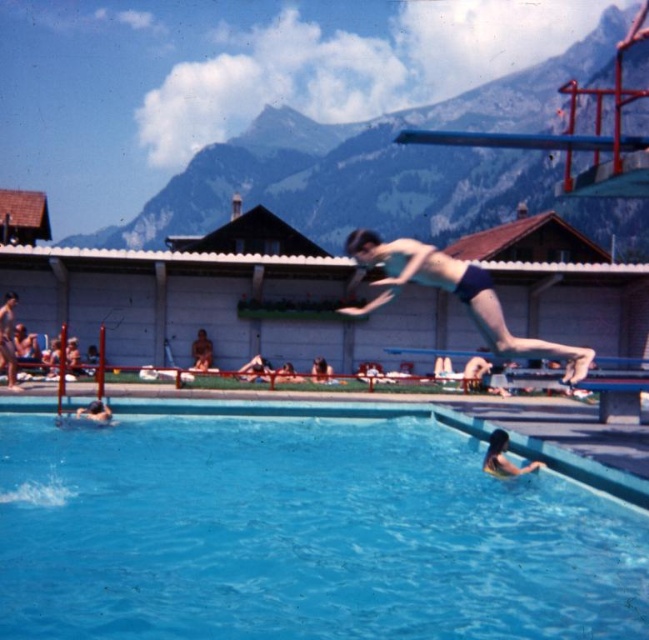
Question: Among these objects, which one is nearest to the camera?

Choices:
 (A) smooth skin person at lower left
 (B) smooth skin person at lower right
 (C) smooth skin diver at center

Answer: (B)

Question: Which point is closer to the camera?

Choices:
 (A) smooth skin person at center
 (B) smooth skin person at lower right

Answer: (B)

Question: Which point is farther from the camera taking this photo?

Choices:
 (A) (480, 278)
 (B) (5, 298)

Answer: (B)

Question: Where is smooth skin diver at center located in relation to smooth skin person at lower left in the image?

Choices:
 (A) right
 (B) left

Answer: (B)

Question: Is blue smooth water at center above smooth skin person at lower right?

Choices:
 (A) no
 (B) yes

Answer: (A)

Question: Can you confirm if blue smooth water at center is positioned to the left of matte blue swim trunks at center?

Choices:
 (A) no
 (B) yes

Answer: (B)